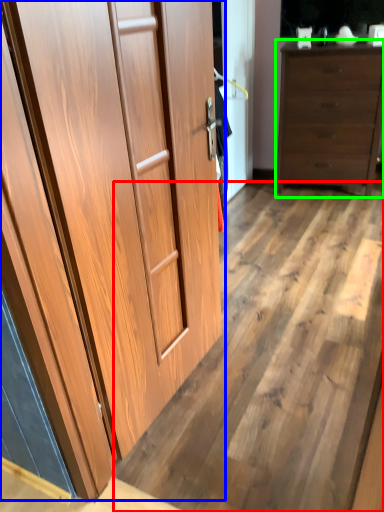
Question: Based on their relative distances, which object is nearer to plywood (highlighted by a red box)? Choose from cupboard (highlighted by a blue box) and chest of drawers (highlighted by a green box).

Choices:
 (A) cupboard
 (B) chest of drawers

Answer: (A)